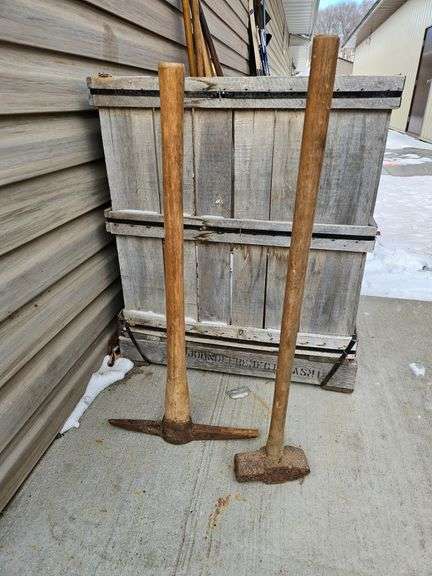
Image resolution: width=432 pixels, height=576 pixels. In order to click on wall in this screenshot , I will do `click(35, 391)`.